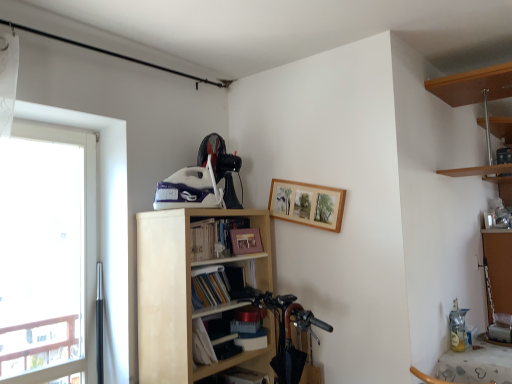
Question: From a real-world perspective, relative to matte paper book at center, the 2th book positioned from the top, is wooden picture frame at upper center, the 1th picture frame when ordered from left to right, vertically above or below?

Choices:
 (A) below
 (B) above

Answer: (B)

Question: In terms of width, does wooden picture frame at upper center, which is counted as the first picture frame, starting from the bottom, look wider or thinner when compared to matte paper book at center, marked as the first book in a bottom-to-top arrangement?

Choices:
 (A) wide
 (B) thin

Answer: (B)

Question: Estimate the real-world distances between objects in this image. Which object is farther from the wooden picture frame at upper center, acting as the second picture frame starting from the top?

Choices:
 (A) hardcover book at center, which appears as the 1th book when viewed from the top
 (B) matte paper book at center, marked as the first book in a bottom-to-top arrangement
 (C) transparent glass window at left
 (D) light wood bookshelf at center
 (E) wooden picture frame at upper center, which is counted as the 2th picture frame, starting from the left

Answer: (C)

Question: Estimate the real-world distances between objects in this image. Which object is closer to the shiny black mountain bike at lower center?

Choices:
 (A) wooden picture frame at upper center, placed as the 1th picture frame when sorted from right to left
 (B) transparent glass window at left
 (C) hardcover book at center, which appears as the 1th book when viewed from the top
 (D) matte paper book at center, marked as the first book in a bottom-to-top arrangement
 (E) wooden picture frame at upper center, acting as the second picture frame starting from the top

Answer: (D)